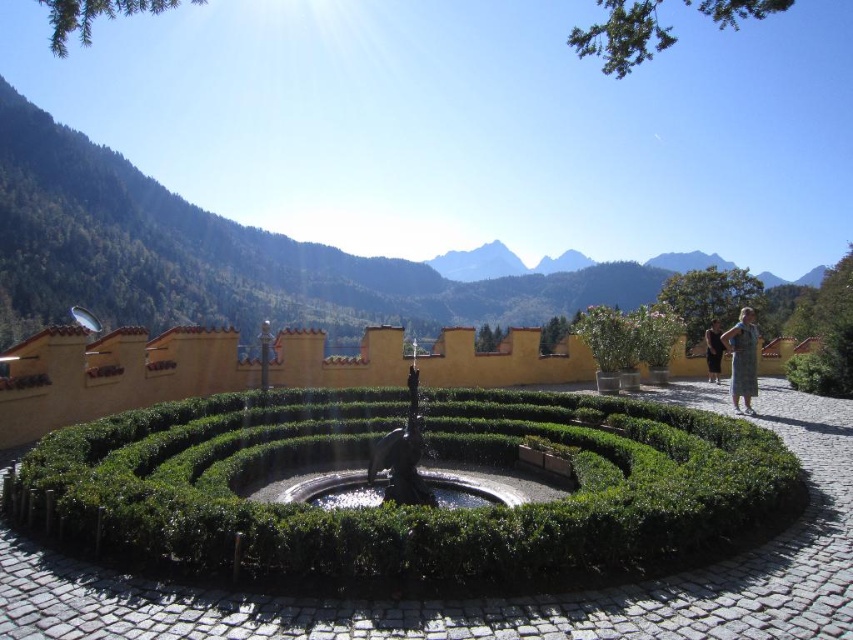
Which is below, green leafy hedge at center or green forested mountain at upper center?

Positioned lower is green leafy hedge at center.

Does green leafy hedge at center have a smaller size compared to green forested mountain at upper center?

Indeed, green leafy hedge at center has a smaller size compared to green forested mountain at upper center.

Does point (202, 406) come closer to viewer compared to point (122, 280)?

Yes.

Identify the location of green leafy hedge at center. (404, 508).

Can you confirm if green leafy hedge at center is thinner than bronze statue at center?

No.

Between green leafy hedge at center and bronze statue at center, which one is positioned higher?

green leafy hedge at center is above.

Who is more forward, [486,518] or [376,444]?

Point [486,518] is more forward.

Locate an element on the screen. green leafy hedge at center is located at coordinates (404, 508).

Between point (490, 499) and point (708, 356), which one is positioned in front?

Positioned in front is point (490, 499).

Which is more to the right, bronze statue at center or dark blue fabric dress at right?

dark blue fabric dress at right is more to the right.

Which is behind, point (341, 486) or point (717, 344)?

Positioned behind is point (717, 344).

Identify the location of bronze statue at center. (399, 472).